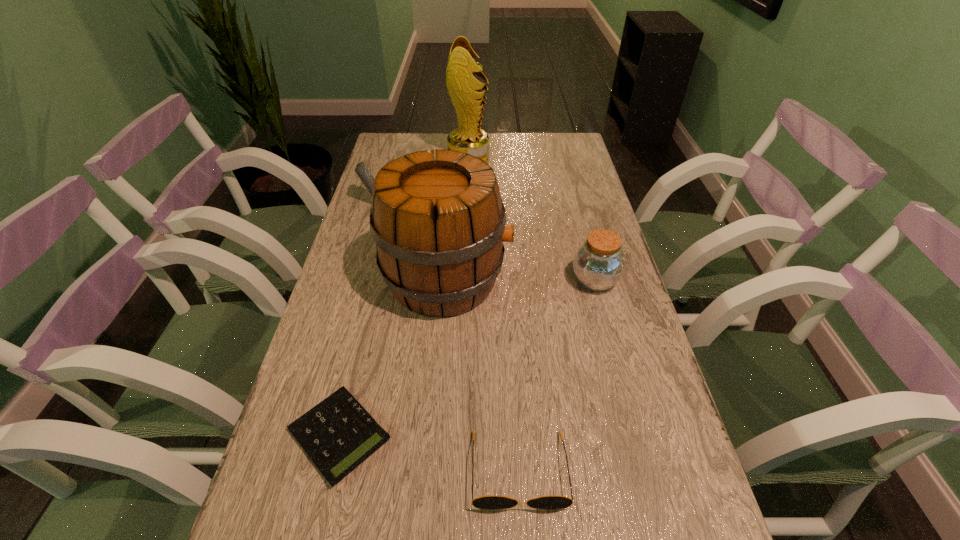
This screenshot has height=540, width=960. I want to click on free location located on the side of the cider where the spigot is located, so click(538, 280).

You are a GUI agent. You are given a task and a screenshot of the screen. Output one action in this format:
    pyautogui.click(x=<x>, y=<y>)
    Task: Click on the free space located 0.050m on the left of the jar
    
    Given the screenshot: What is the action you would take?
    pyautogui.click(x=550, y=281)

Locate an element on the screen. The image size is (960, 540). free space located on the front-facing side of the farther calculator is located at coordinates (463, 201).

Locate an element on the screen. vacant space situated 0.050m on the right of the nearer calculator is located at coordinates (419, 435).

Where is `object situated at the far edge`? object situated at the far edge is located at coordinates (463, 88).

Where is `cider present at the left edge`? Image resolution: width=960 pixels, height=540 pixels. cider present at the left edge is located at coordinates (439, 223).

Image resolution: width=960 pixels, height=540 pixels. Identify the location of object situated at the right edge. (598, 264).

In the image, there is a desktop. At what (x,y) coordinates should I click in order to perform the action: click on vacant area at the far edge. Please return your answer as a coordinate pair (x, y). Looking at the image, I should click on (506, 140).

At what (x,y) coordinates should I click in order to perform the action: click on vacant region at the left edge of the desktop. Please return your answer as a coordinate pair (x, y). This screenshot has height=540, width=960. Looking at the image, I should click on (357, 305).

Locate an element on the screen. free space at the right edge is located at coordinates (604, 355).